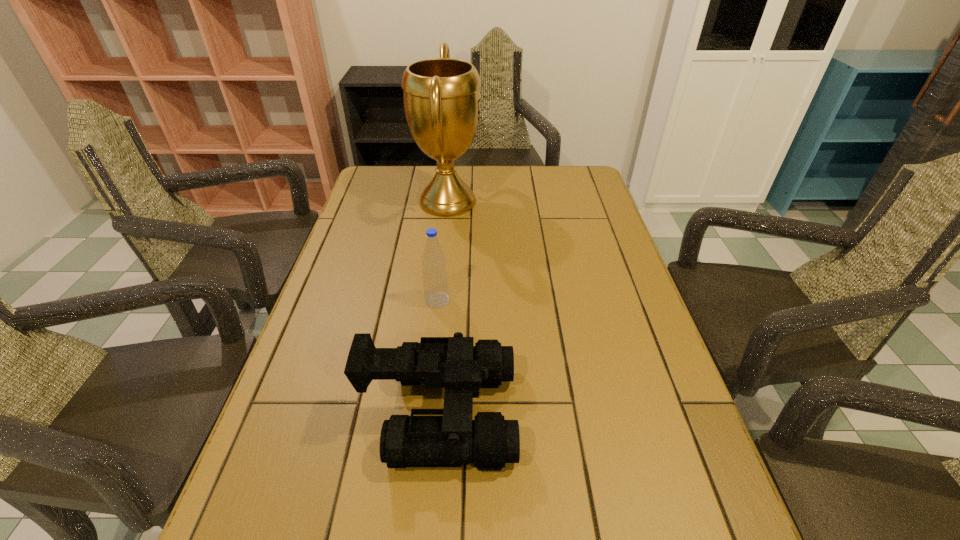
Where is `vacant space at the left edge of the desktop`? The image size is (960, 540). vacant space at the left edge of the desktop is located at coordinates (366, 221).

Locate an element on the screen. The width and height of the screenshot is (960, 540). free space at the right edge of the desktop is located at coordinates (600, 291).

Image resolution: width=960 pixels, height=540 pixels. I want to click on vacant space at the far right corner of the desktop, so click(x=567, y=165).

Where is `object that is the second nearest to the second farthest object`? object that is the second nearest to the second farthest object is located at coordinates (442, 103).

Identify the location of object that stands as the closest to the second farthest object. (489, 441).